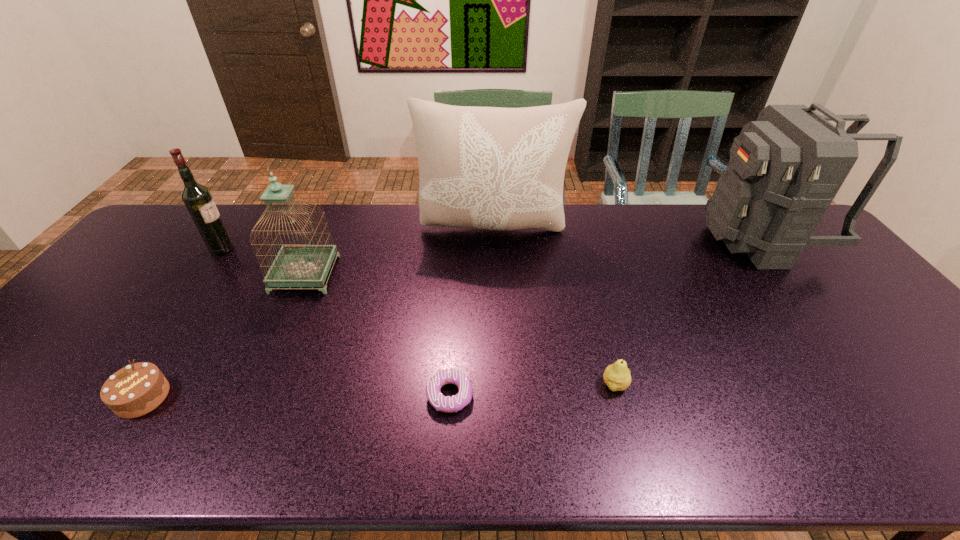
Identify the location of free spot between the rightmost object and the cushion. (627, 234).

Where is `free point between the birdcage and the chocolate cake`? Image resolution: width=960 pixels, height=540 pixels. free point between the birdcage and the chocolate cake is located at coordinates (224, 336).

At what (x,y) coordinates should I click in order to perform the action: click on free point between the wine bottle and the birdcage. Please return your answer as a coordinate pair (x, y). This screenshot has height=540, width=960. Looking at the image, I should click on (264, 262).

Where is `free space between the wine bottle and the rightmost object`? free space between the wine bottle and the rightmost object is located at coordinates (492, 244).

At what (x,y) coordinates should I click in order to perform the action: click on free spot between the wine bottle and the pear. Please return your answer as a coordinate pair (x, y). The width and height of the screenshot is (960, 540). Looking at the image, I should click on (419, 317).

The width and height of the screenshot is (960, 540). I want to click on object that ranks as the fifth closest to the pear, so [x=135, y=390].

Identify which object is the closest to the cushion. Please provide its 2D coordinates. Your answer should be formatted as a tuple, i.e. [(x, y)], where the tuple contains the x and y coordinates of a point satisfying the conditions above.

[(296, 265)]

This screenshot has width=960, height=540. In order to click on vacant area that satisfies the following two spatial constraints: 1. on the front side of the cushion; 2. on the front and back of the wine bottle in this screenshot , I will do `click(494, 249)`.

At what (x,y) coordinates should I click in order to perform the action: click on vacant space that satisfies the following two spatial constraints: 1. on the front compartment of the backpack; 2. at the door of the birdcage. Please return your answer as a coordinate pair (x, y). Looking at the image, I should click on (787, 274).

The width and height of the screenshot is (960, 540). Identify the location of vacant space that satisfies the following two spatial constraints: 1. on the front and back of the chocolate cake; 2. on the left side of the wine bottle. (119, 397).